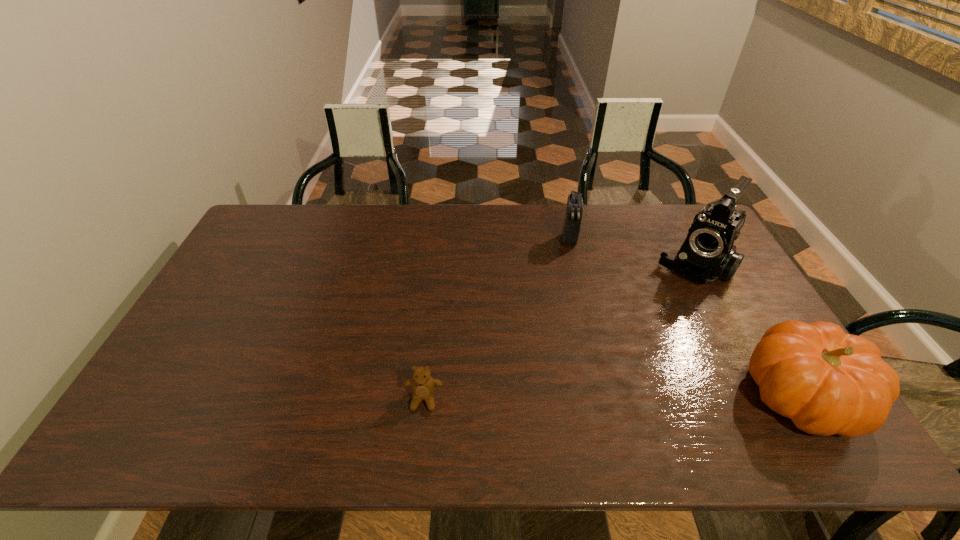
Find the location of a particular element. free region located with the zip open on the third tallest object is located at coordinates (572, 339).

I want to click on vacant space located 0.230m with the zip open on the third tallest object, so click(571, 297).

This screenshot has height=540, width=960. What are the coordinates of `vacant area situated 0.220m with the zip open on the third tallest object` in the screenshot? It's located at (571, 295).

Find the location of a particular element. object that is at the far edge is located at coordinates (572, 222).

Find the location of a particular element. teddy bear positioned at the near edge is located at coordinates (423, 386).

I want to click on pumpkin that is at the near edge, so click(x=827, y=382).

Locate an element on the screen. Image resolution: width=960 pixels, height=540 pixels. pumpkin situated at the right edge is located at coordinates (827, 382).

Find the location of `camcorder that is at the right edge`. camcorder that is at the right edge is located at coordinates (708, 253).

In order to click on object at the near right corner in this screenshot , I will do `click(827, 382)`.

The width and height of the screenshot is (960, 540). Find the location of `vacant space at the far edge`. vacant space at the far edge is located at coordinates (329, 208).